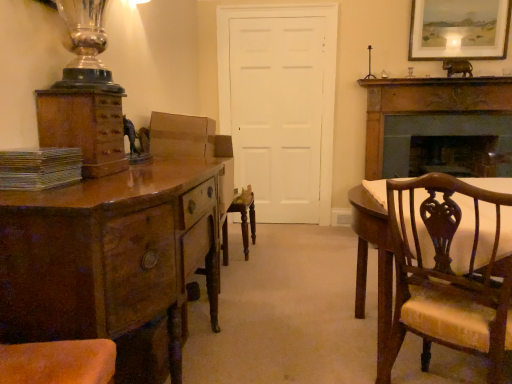
Where is `free space in front of white matte door at center`? free space in front of white matte door at center is located at coordinates click(285, 240).